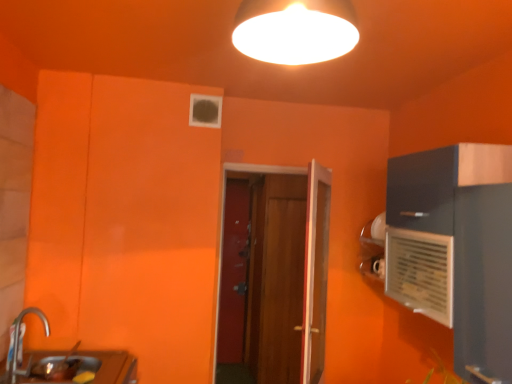
Measure the distance between wooden door at center, acting as the second door starting from the back, and camera.

The distance of wooden door at center, acting as the second door starting from the back, from camera is 3.64 meters.

The image size is (512, 384). Find the location of `wooden door at center, acting as the second door starting from the back`. wooden door at center, acting as the second door starting from the back is located at coordinates (285, 275).

Image resolution: width=512 pixels, height=384 pixels. I want to click on smooth wooden door at center, placed as the 1th door when sorted from back to front, so click(x=234, y=272).

In order to face metallic silver sink at lower left, should I rotate leftwards or rightwards?

A 24.551 degree turn to the left will do.

Describe the element at coordinates (295, 30) in the screenshot. I see `white glossy lampshade at upper center` at that location.

Locate an element on the screen. The height and width of the screenshot is (384, 512). wooden door at center, arranged as the 2th door when viewed from the front is located at coordinates (285, 275).

Considering the positions of points (106, 356) and (262, 269), is point (106, 356) farther from camera compared to point (262, 269)?

No, it is in front of (262, 269).

How much distance is there between metallic silver sink at lower left and wooden door at center, acting as the second door starting from the back?

metallic silver sink at lower left is 1.98 meters from wooden door at center, acting as the second door starting from the back.

Can we say metallic silver sink at lower left lies outside wooden door at center, acting as the second door starting from the back?

Yes, metallic silver sink at lower left is outside of wooden door at center, acting as the second door starting from the back.

Does metallic silver sink at lower left have a larger size compared to wooden door at center, acting as the second door starting from the back?

Actually, metallic silver sink at lower left might be smaller than wooden door at center, acting as the second door starting from the back.

Considering the positions of points (220, 269) and (49, 326), is point (220, 269) farther from camera compared to point (49, 326)?

Yes, it is.

Is wooden door at center, acting as the second door starting from the back, completely or partially outside of brushed metal faucet at lower left?

Yes, wooden door at center, acting as the second door starting from the back, is outside of brushed metal faucet at lower left.

Considering the positions of objects wooden door at center, acting as the second door starting from the back, and brushed metal faucet at lower left in the image provided, who is more to the right, wooden door at center, acting as the second door starting from the back, or brushed metal faucet at lower left?

From the viewer's perspective, wooden door at center, acting as the second door starting from the back, appears more on the right side.

Can you tell me how much white glossy lampshade at upper center and wooden door at center, arranged as the first door when viewed from the front, differ in facing direction?

63.9 degrees separate the facing orientations of white glossy lampshade at upper center and wooden door at center, arranged as the first door when viewed from the front.

From a real-world perspective, is white glossy lampshade at upper center over wooden door at center, placed as the 3th door when sorted from back to front?

Yes, from a real-world perspective, white glossy lampshade at upper center is on top of wooden door at center, placed as the 3th door when sorted from back to front.

Do you think white glossy lampshade at upper center is within wooden door at center, placed as the 3th door when sorted from back to front, or outside of it?

white glossy lampshade at upper center is outside wooden door at center, placed as the 3th door when sorted from back to front.

Does white glossy lampshade at upper center touch wooden door at center, placed as the 3th door when sorted from back to front?

No, white glossy lampshade at upper center is not touching wooden door at center, placed as the 3th door when sorted from back to front.

Considering the sizes of objects metallic silver sink at lower left and white glossy lampshade at upper center in the image provided, who is smaller, metallic silver sink at lower left or white glossy lampshade at upper center?

white glossy lampshade at upper center.

Which is in front, point (96, 378) or point (320, 52)?

The point (320, 52) is closer to the camera.

Is metallic silver sink at lower left positioned with its back to white glossy lampshade at upper center?

That's not correct — metallic silver sink at lower left is not looking away from white glossy lampshade at upper center.

Would you say brushed metal faucet at lower left is outside white glossy lampshade at upper center?

Yes, brushed metal faucet at lower left is outside of white glossy lampshade at upper center.

Looking at this image, which is closer to the camera, (16, 363) or (263, 25)?

Point (263, 25)

Can you confirm if brushed metal faucet at lower left is taller than white glossy lampshade at upper center?

Yes, brushed metal faucet at lower left is taller than white glossy lampshade at upper center.

Considering the positions of objects brushed metal faucet at lower left and white glossy lampshade at upper center in the image provided, who is behind, brushed metal faucet at lower left or white glossy lampshade at upper center?

Positioned behind is brushed metal faucet at lower left.

Is wooden door at center, acting as the second door starting from the back, positioned behind white plastic air conditioner at right?

Yes, the depth of wooden door at center, acting as the second door starting from the back, is greater than that of white plastic air conditioner at right.

Is wooden door at center, acting as the second door starting from the back, not within white plastic air conditioner at right?

Yes, wooden door at center, acting as the second door starting from the back, is outside of white plastic air conditioner at right.

Is wooden door at center, acting as the second door starting from the back, in contact with white plastic air conditioner at right?

They are not placed beside each other.

Considering the sizes of objects smooth wooden door at center, which is the 3th door from front to back, and white glossy lampshade at upper center in the image provided, who is taller, smooth wooden door at center, which is the 3th door from front to back, or white glossy lampshade at upper center?

With more height is smooth wooden door at center, which is the 3th door from front to back.

Is smooth wooden door at center, placed as the 1th door when sorted from back to front, not inside white glossy lampshade at upper center?

Yes, smooth wooden door at center, placed as the 1th door when sorted from back to front, is outside of white glossy lampshade at upper center.

From the image's perspective, would you say smooth wooden door at center, which is the 3th door from front to back, is positioned over white glossy lampshade at upper center?

Actually, smooth wooden door at center, which is the 3th door from front to back, appears below white glossy lampshade at upper center in the image.

In order to click on the 2nd door above the metallic silver sink at lower left (from a real-world perspective) in this screenshot , I will do `click(285, 275)`.

From the brushed metal faucet at lower left, count 2nd doors backward and point to it. Please provide its 2D coordinates.

[(285, 275)]

Looking at the image, which one is located further to metallic silver sink at lower left, white plastic air conditioner at right or white glossy lampshade at upper center?

white glossy lampshade at upper center.

Estimate the real-world distances between objects in this image. Which object is closer to white glossy lampshade at upper center, metallic silver sink at lower left or brushed metal faucet at lower left?

brushed metal faucet at lower left is closer to white glossy lampshade at upper center.

Which object lies further to the anchor point smooth wooden door at center, which is the 3th door from front to back, metallic silver sink at lower left or wooden door at center, acting as the second door starting from the back?

metallic silver sink at lower left is positioned further to the anchor smooth wooden door at center, which is the 3th door from front to back.

From the image, which object appears to be nearer to white glossy lampshade at upper center, brushed metal faucet at lower left or wooden door at center, arranged as the 2th door when viewed from the front?

Among the two, brushed metal faucet at lower left is located nearer to white glossy lampshade at upper center.

When comparing their distances from white plastic air conditioner at right, does metallic silver sink at lower left or smooth wooden door at center, placed as the 1th door when sorted from back to front, seem closer?

Among the two, metallic silver sink at lower left is located nearer to white plastic air conditioner at right.

Based on the photo, based on their spatial positions, is white plastic air conditioner at right or wooden door at center, acting as the second door starting from the back, closer to white glossy lampshade at upper center?

white plastic air conditioner at right.

Consider the image. Considering their positions, is brushed metal faucet at lower left positioned closer to metallic silver sink at lower left than wooden door at center, acting as the second door starting from the back?

brushed metal faucet at lower left lies closer to metallic silver sink at lower left than the other object.

From the image, which object appears to be nearer to white plastic air conditioner at right, white glossy lampshade at upper center or wooden door at center, acting as the second door starting from the back?

white glossy lampshade at upper center lies closer to white plastic air conditioner at right than the other object.

What are the coordinates of `lamp between brushed metal faucet at lower left and wooden door at center, placed as the 3th door when sorted from back to front, in the horizontal direction` in the screenshot? It's located at (295, 30).

In order to click on air conditioning between white glossy lampshade at upper center and wooden door at center, arranged as the first door when viewed from the front, along the z-axis in this screenshot , I will do `click(420, 272)`.

You are a GUI agent. You are given a task and a screenshot of the screen. Output one action in this format:
    pyautogui.click(x=<x>, y=<y>)
    Task: Click on the lamp situated between brushed metal faucet at lower left and white plastic air conditioner at right from left to right
    
    Given the screenshot: What is the action you would take?
    pyautogui.click(x=295, y=30)

Where is `tap between metallic silver sink at lower left and smooth wooden door at center, which is the 3th door from front to back, along the z-axis`? tap between metallic silver sink at lower left and smooth wooden door at center, which is the 3th door from front to back, along the z-axis is located at coordinates (21, 344).